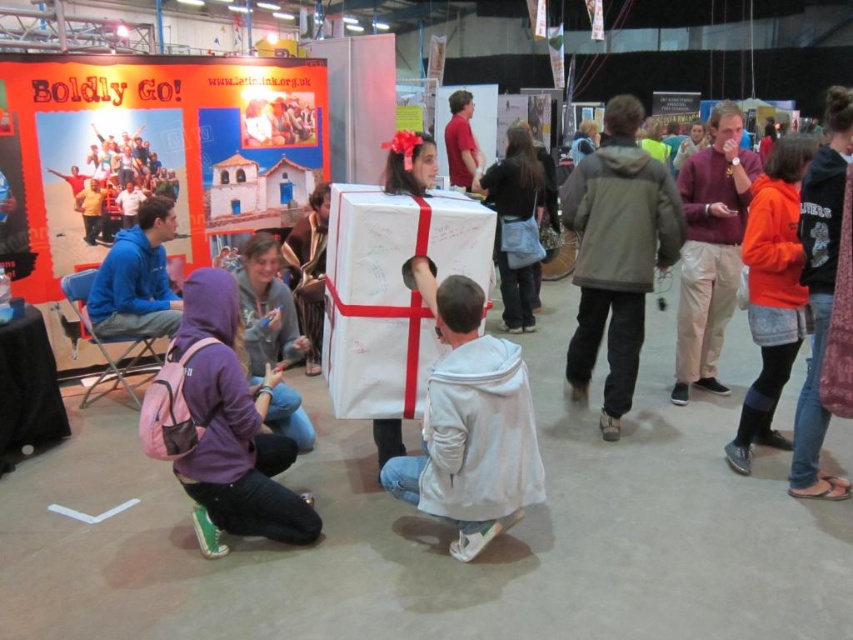
Question: Is maroon sweater at upper center positioned before orange fleece jacket at right?

Choices:
 (A) yes
 (B) no

Answer: (B)

Question: Estimate the real-world distances between objects in this image. Which object is closer to the matte red shirt at upper center?

Choices:
 (A) purple hoodie at lower left
 (B) orange fleece jacket at right
 (C) blue fleece jacket at left
 (D) maroon sweater at upper center

Answer: (D)

Question: Does gray fabric jacket at center have a greater width compared to orange fleece jacket at right?

Choices:
 (A) yes
 (B) no

Answer: (A)

Question: Which point is farther from the camera taking this photo?

Choices:
 (A) (480, 506)
 (B) (730, 134)
 (C) (152, 225)
 (D) (451, 145)

Answer: (D)

Question: Can you confirm if gray fabric jacket at center is positioned to the left of blue fleece jacket at left?

Choices:
 (A) yes
 (B) no

Answer: (B)

Question: Which of the following is the closest to the observer?

Choices:
 (A) purple hoodie at lower left
 (B) gray fabric jacket at center
 (C) maroon sweater at upper center
 (D) matte red shirt at upper center

Answer: (A)